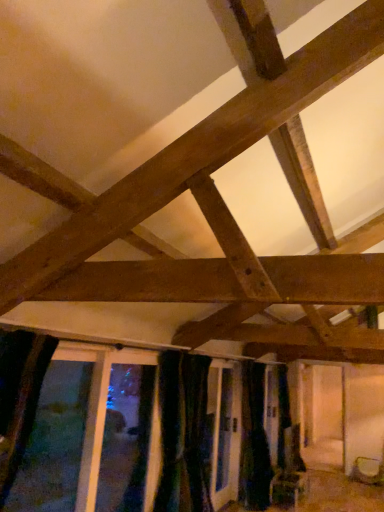
Question: From a real-world perspective, is black fabric curtain at lower center on top of matte brown basket at lower right?

Choices:
 (A) yes
 (B) no

Answer: (A)

Question: Considering the relative positions of black fabric curtain at lower center and matte brown basket at lower right in the image provided, is black fabric curtain at lower center to the right of matte brown basket at lower right from the viewer's perspective?

Choices:
 (A) yes
 (B) no

Answer: (B)

Question: Is black fabric curtain at lower center directly adjacent to matte brown basket at lower right?

Choices:
 (A) yes
 (B) no

Answer: (B)

Question: From the image's perspective, would you say black fabric curtain at lower center is positioned over matte brown basket at lower right?

Choices:
 (A) yes
 (B) no

Answer: (A)

Question: Can matte brown basket at lower right be found inside black fabric curtain at lower center?

Choices:
 (A) yes
 (B) no

Answer: (B)

Question: In the image, is black fabric curtain at lower center positioned in front of or behind matte brown basket at lower right?

Choices:
 (A) behind
 (B) front

Answer: (B)

Question: Looking at their shapes, would you say black fabric curtain at lower center is wider or thinner than matte brown basket at lower right?

Choices:
 (A) wide
 (B) thin

Answer: (B)

Question: From a real-world perspective, relative to matte brown basket at lower right, is black fabric curtain at lower center vertically above or below?

Choices:
 (A) below
 (B) above

Answer: (B)

Question: From the image's perspective, is black fabric curtain at lower center located above or below matte brown basket at lower right?

Choices:
 (A) below
 (B) above

Answer: (B)

Question: Based on their positions, is matte brown basket at lower right located to the left or right of transparent glass window at lower left?

Choices:
 (A) left
 (B) right

Answer: (B)

Question: Considering the positions of point (355, 476) and point (16, 494), is point (355, 476) closer or farther from the camera than point (16, 494)?

Choices:
 (A) closer
 (B) farther

Answer: (B)

Question: Is matte brown basket at lower right inside the boundaries of transparent glass window at lower left, or outside?

Choices:
 (A) outside
 (B) inside

Answer: (A)

Question: From the image's perspective, relative to transparent glass window at lower left, is matte brown basket at lower right above or below?

Choices:
 (A) above
 (B) below

Answer: (B)

Question: From the image's perspective, relative to matte brown basket at lower right, is transparent glass window at lower left above or below?

Choices:
 (A) above
 (B) below

Answer: (A)

Question: Considering the positions of transparent glass window at lower left and matte brown basket at lower right in the image, is transparent glass window at lower left taller or shorter than matte brown basket at lower right?

Choices:
 (A) short
 (B) tall

Answer: (B)